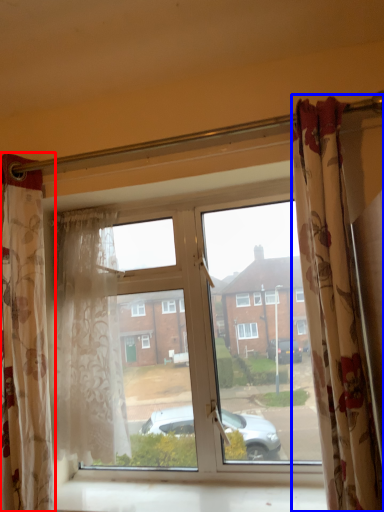
Question: Which object is further to the camera taking this photo, curtain (highlighted by a red box) or curtain (highlighted by a blue box)?

Choices:
 (A) curtain
 (B) curtain

Answer: (A)